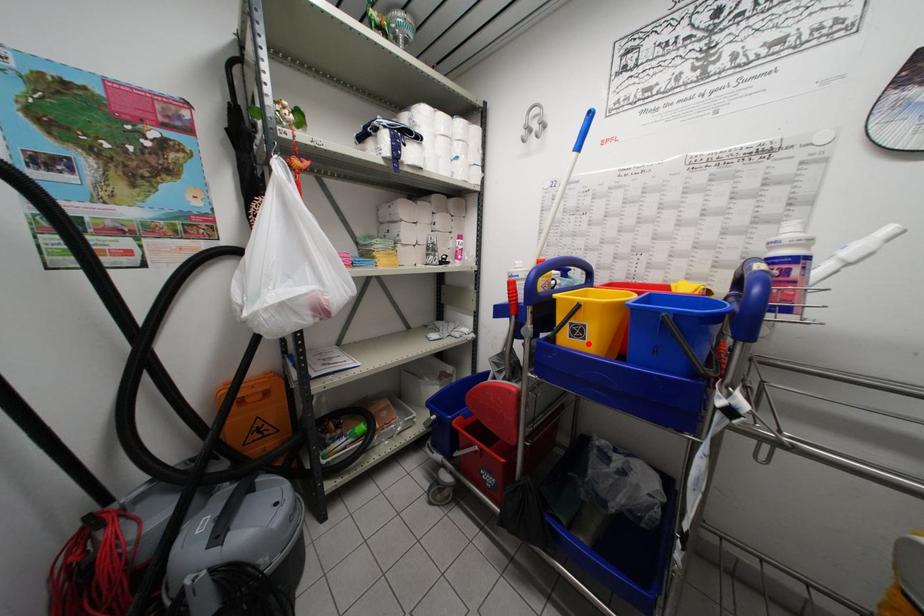
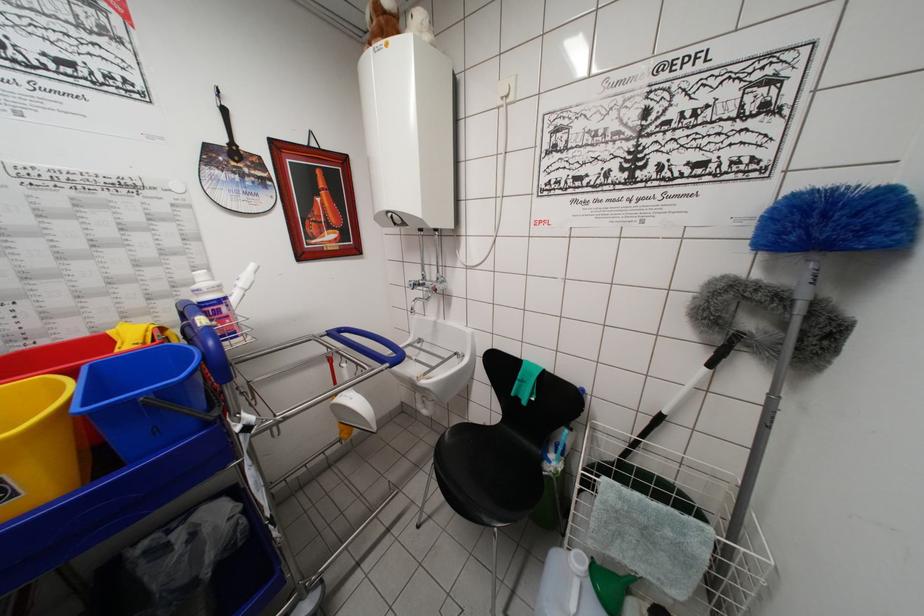
Find the pixel in the second image that matches the highlighted location in the first image.

(20, 500)